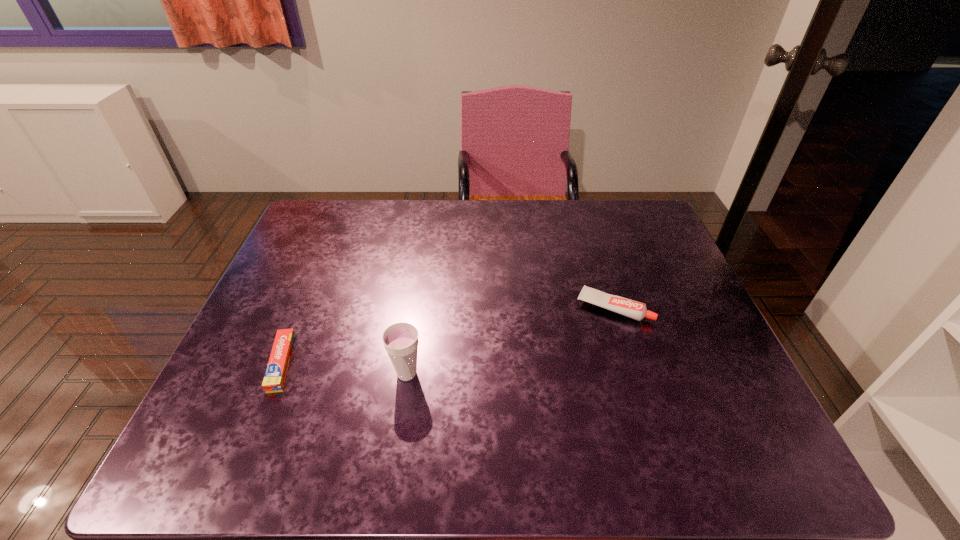
The width and height of the screenshot is (960, 540). Find the location of `free space that satisfies the following two spatial constraints: 1. on the back side of the tallest object; 2. on the right side of the taller toothpaste`. free space that satisfies the following two spatial constraints: 1. on the back side of the tallest object; 2. on the right side of the taller toothpaste is located at coordinates (417, 307).